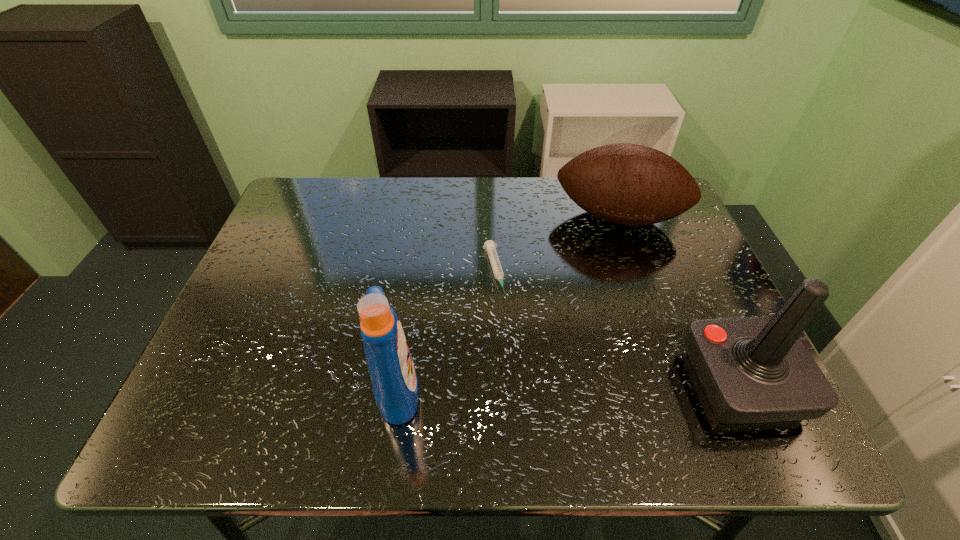
Locate an element on the screen. The height and width of the screenshot is (540, 960). free space on the desktop that is between the detergent and the joystick and is positioned at the needle end of the shortest object is located at coordinates (528, 386).

Find the location of `free space on the desktop that is between the detergent and the joystick and is positioned on the laces of the third tallest object`. free space on the desktop that is between the detergent and the joystick and is positioned on the laces of the third tallest object is located at coordinates (608, 385).